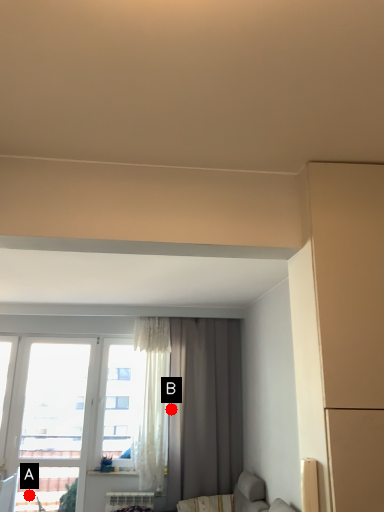
Question: Two points are circled on the image, labeled by A and B beside each circle. Which point is farther from the camera taking this photo?

Choices:
 (A) A is further
 (B) B is further

Answer: (B)